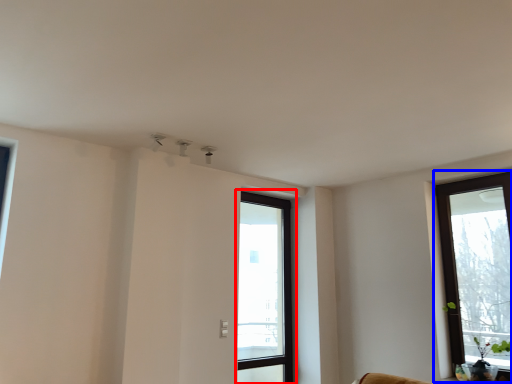
Question: Which point is closer to the camera, window (highlighted by a red box) or window (highlighted by a blue box)?

Choices:
 (A) window
 (B) window

Answer: (B)